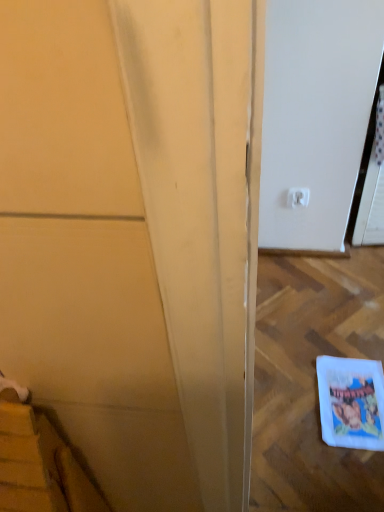
Identify the location of free space to the back side of white paper comic book at lower right. The image size is (384, 512). (332, 341).